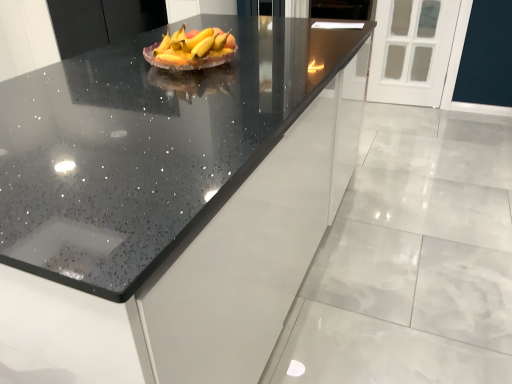
The width and height of the screenshot is (512, 384). Describe the element at coordinates (193, 50) in the screenshot. I see `yellow matte grapefruit at center` at that location.

Where is `black speckled countertop at center`? black speckled countertop at center is located at coordinates (149, 144).

Which object is positioned more to the right, black speckled countertop at center or yellow matte grapefruit at center?

From the viewer's perspective, yellow matte grapefruit at center appears more on the right side.

From the image's perspective, is black speckled countertop at center located beneath yellow matte grapefruit at center?

Correct, black speckled countertop at center appears lower than yellow matte grapefruit at center in the image.

Is black speckled countertop at center bigger than yellow matte grapefruit at center?

Yes.

From a real-world perspective, who is located higher, black speckled countertop at center or yellow matte grapefruit at center?

yellow matte grapefruit at center.

Considering their positions, is black speckled countertop at center located in front of or behind yellow matte grapefruit at center?

black speckled countertop at center is behind yellow matte grapefruit at center.

Is black speckled countertop at center beside yellow matte grapefruit at center?

No, black speckled countertop at center is not next to yellow matte grapefruit at center.

Is black speckled countertop at center inside or outside of yellow matte grapefruit at center?

black speckled countertop at center cannot be found inside yellow matte grapefruit at center.

Which point is more distant from viewer, (156, 52) or (130, 6)?

Positioned behind is point (130, 6).

Consider the image. From a real-world perspective, relative to black speckled countertop at center, is yellow matte grapefruit at center vertically above or below?

Clearly, from a real-world perspective, yellow matte grapefruit at center is above black speckled countertop at center.

Is yellow matte grapefruit at center closer to camera compared to black speckled countertop at center?

That is True.

Is yellow matte grapefruit at center touching black speckled countertop at center?

No.

Is black speckled countertop at center further to camera compared to black speckled countertop at center?

Yes, black speckled countertop at center is further from the camera.

Is there a large distance between black speckled countertop at center and black speckled countertop at center?

Indeed, black speckled countertop at center is not near black speckled countertop at center.

Would you say black speckled countertop at center is outside black speckled countertop at center?

Yes.

Is black speckled countertop at center oriented away from black speckled countertop at center?

No, black speckled countertop at center is not facing the opposite direction of black speckled countertop at center.

Which object is further away from the camera taking this photo, yellow matte grapefruit at center or black speckled countertop at center?

yellow matte grapefruit at center is behind.

Is yellow matte grapefruit at center beside black speckled countertop at center?

No, yellow matte grapefruit at center is not making contact with black speckled countertop at center.

Can you confirm if yellow matte grapefruit at center is thinner than black speckled countertop at center?

Correct, the width of yellow matte grapefruit at center is less than that of black speckled countertop at center.

Consider the image. Can you confirm if yellow matte grapefruit at center is taller than black speckled countertop at center?

No.

Does black speckled countertop at center appear on the left side of black speckled countertop at center?

In fact, black speckled countertop at center is to the right of black speckled countertop at center.

Can you tell me how much black speckled countertop at center and black speckled countertop at center differ in facing direction?

The facing directions of black speckled countertop at center and black speckled countertop at center are 92.5 degrees apart.

Which of these two, black speckled countertop at center or black speckled countertop at center, is bigger?

With larger size is black speckled countertop at center.

In the scene shown: Do you think black speckled countertop at center is within black speckled countertop at center, or outside of it?

black speckled countertop at center is not inside black speckled countertop at center, it's outside.

Image resolution: width=512 pixels, height=384 pixels. I want to click on grapefruit located above the black speckled countertop at center (from the image's perspective), so click(x=193, y=50).

Locate an element on the screen. grapefruit above the black speckled countertop at center (from a real-world perspective) is located at coordinates (193, 50).

Based on their spatial positions, is yellow matte grapefruit at center or black speckled countertop at center closer to black speckled countertop at center?

yellow matte grapefruit at center is positioned closer to the anchor black speckled countertop at center.

Estimate the real-world distances between objects in this image. Which object is closer to yellow matte grapefruit at center, black speckled countertop at center or black speckled countertop at center?

black speckled countertop at center is positioned closer to the anchor yellow matte grapefruit at center.

Which object lies further to the anchor point yellow matte grapefruit at center, black speckled countertop at center or black speckled countertop at center?

Based on the image, black speckled countertop at center appears to be further to yellow matte grapefruit at center.

When comparing their distances from black speckled countertop at center, does black speckled countertop at center or yellow matte grapefruit at center seem closer?

Among the two, black speckled countertop at center is located nearer to black speckled countertop at center.

Which object lies further to the anchor point black speckled countertop at center, yellow matte grapefruit at center or black speckled countertop at center?

yellow matte grapefruit at center is further to black speckled countertop at center.

Considering their positions, is black speckled countertop at center positioned further to black speckled countertop at center than yellow matte grapefruit at center?

Among the two, black speckled countertop at center is located further to black speckled countertop at center.

At what (x,y) coordinates should I click in order to perform the action: click on grapefruit located between black speckled countertop at center and black speckled countertop at center in the depth direction. Please return your answer as a coordinate pair (x, y). The height and width of the screenshot is (384, 512). Looking at the image, I should click on (193, 50).